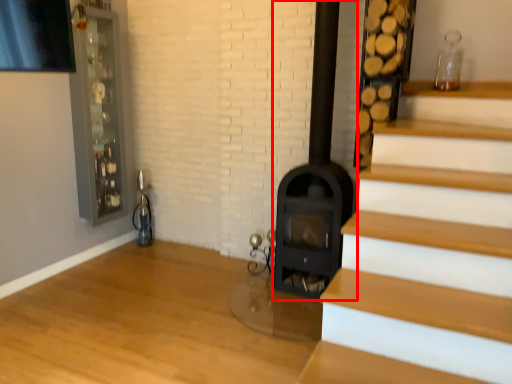
Question: Where is fireplace (annotated by the red box) located in relation to glass door in the image?

Choices:
 (A) right
 (B) left

Answer: (A)